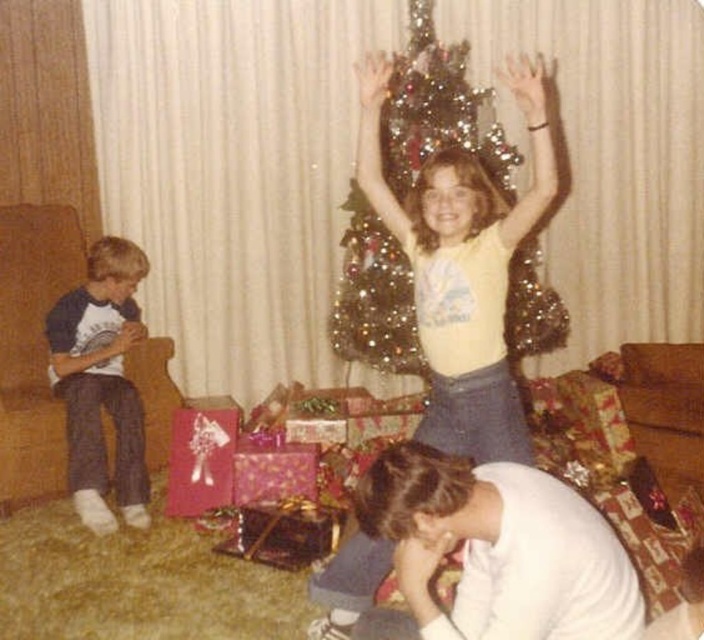
You are a parent trying to decide which gift to place under the Christmas tree. You have the yellow matte shirt at center and the shiny metallic gift at lower center. Based on their sizes, which one should you choose to ensure it fits in the space reserved for smaller decorations?

The shiny metallic gift at lower center should be chosen because it is shorter than the yellow matte shirt at center, making it more suitable for smaller spaces.